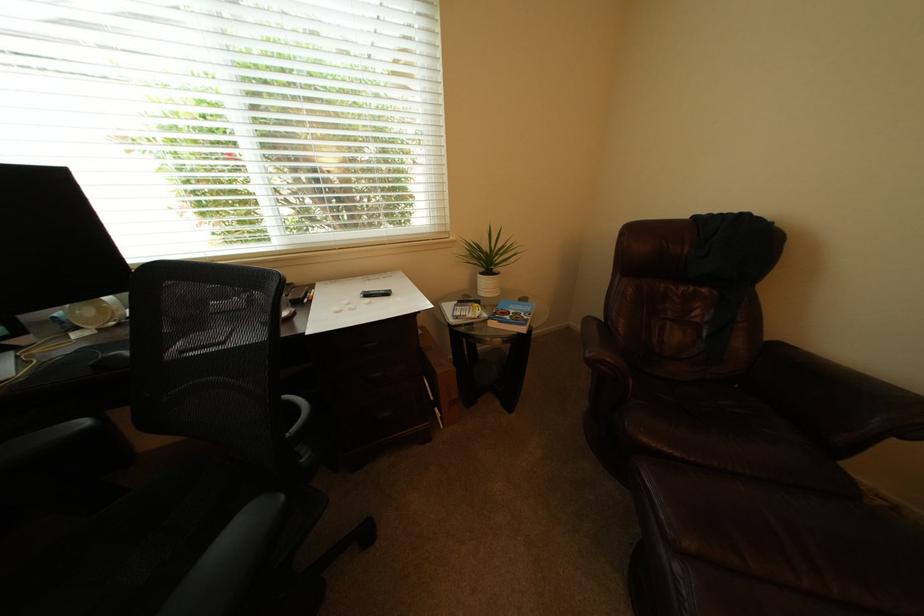
Where would you resting arm the black chair armrest? Please return your answer as a coordinate pair (x, y).

(246, 535)